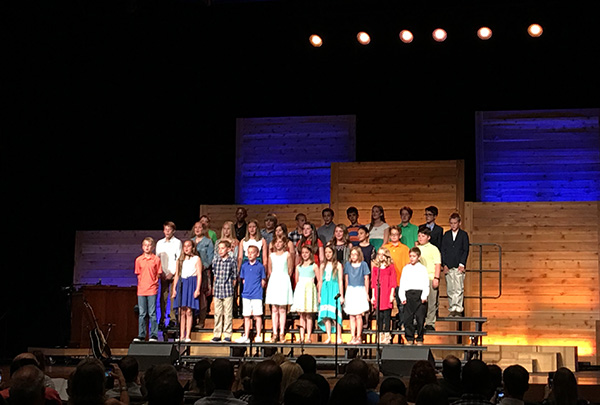
This screenshot has height=405, width=600. Identify the location of stage. [214, 342].